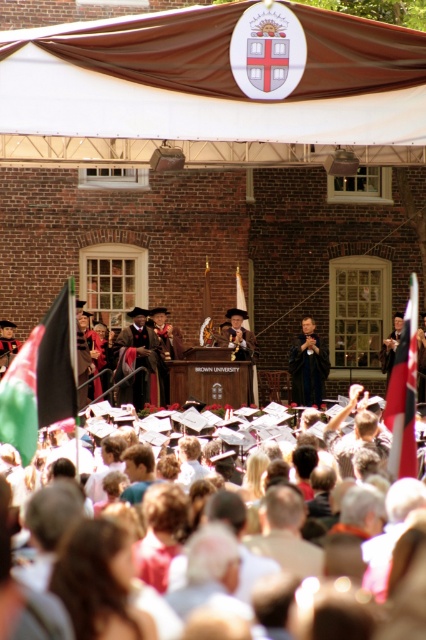
Question: Based on their relative distances, which object is nearer to the velvet black gown at center?

Choices:
 (A) dark blue robe at center
 (B) red fabric flag at center
 (C) white paper hats at center
 (D) green fabric flag at left

Answer: (A)

Question: Among these points, which one is nearest to the camera?

Choices:
 (A) (414, 323)
 (B) (71, 346)

Answer: (B)

Question: Is white paper hats at center bigger than green fabric flag at left?

Choices:
 (A) yes
 (B) no

Answer: (B)

Question: Can you confirm if white paper hats at center is wider than red fabric flag at center?

Choices:
 (A) yes
 (B) no

Answer: (B)

Question: Can you confirm if white paper hats at center is positioned above dark blue robe at center?

Choices:
 (A) yes
 (B) no

Answer: (B)

Question: Which object appears farthest from the camera in this image?

Choices:
 (A) green fabric flag at left
 (B) white paper hats at center
 (C) velvet black gown at center
 (D) dark blue robe at center

Answer: (D)